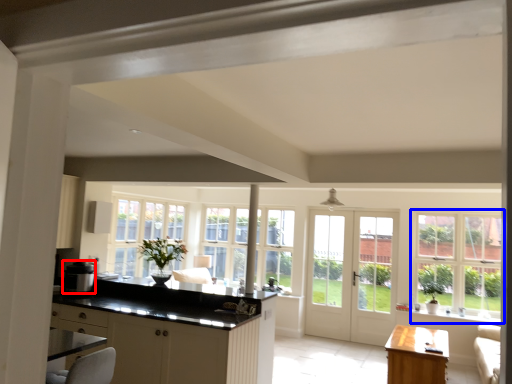
Question: Which of the following is the farthest to the observer, appliance (highlighted by a red box) or window (highlighted by a blue box)?

Choices:
 (A) appliance
 (B) window

Answer: (B)